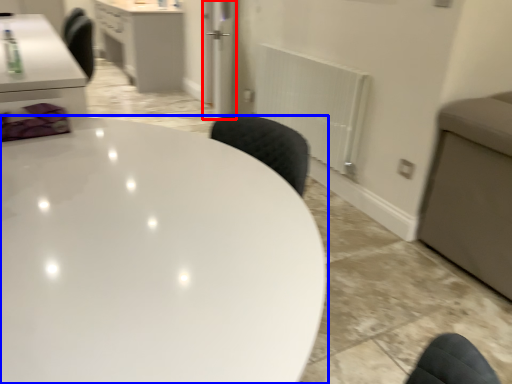
Question: Which object is closer to the camera taking this photo, glass door (highlighted by a red box) or table (highlighted by a blue box)?

Choices:
 (A) glass door
 (B) table

Answer: (B)